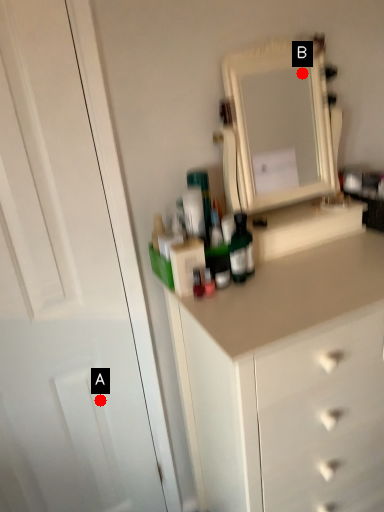
Question: Two points are circled on the image, labeled by A and B beside each circle. Among these points, which one is nearest to the camera?

Choices:
 (A) A is closer
 (B) B is closer

Answer: (A)